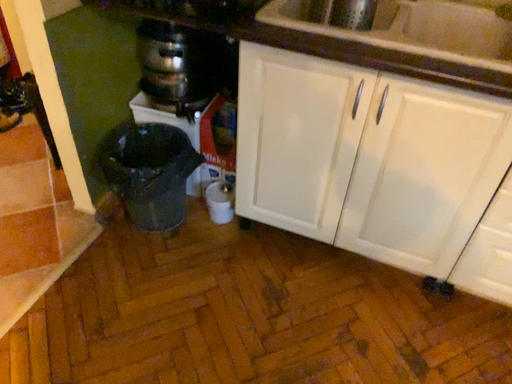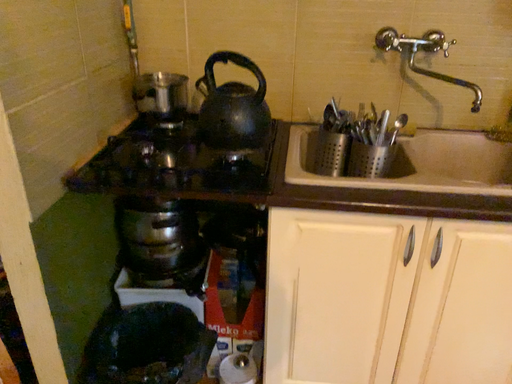
Question: Which way did the camera rotate in the video?

Choices:
 (A) rotated upward
 (B) rotated downward

Answer: (A)